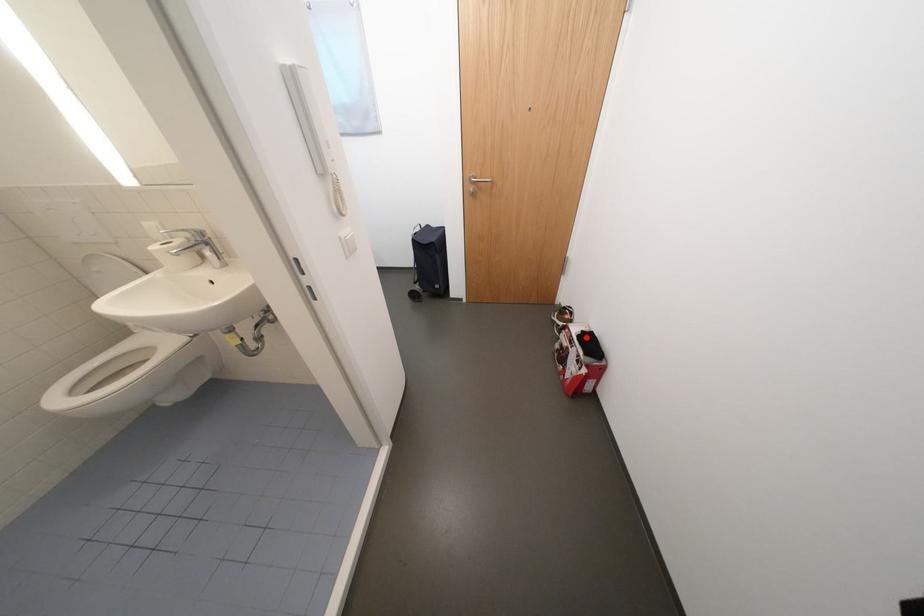
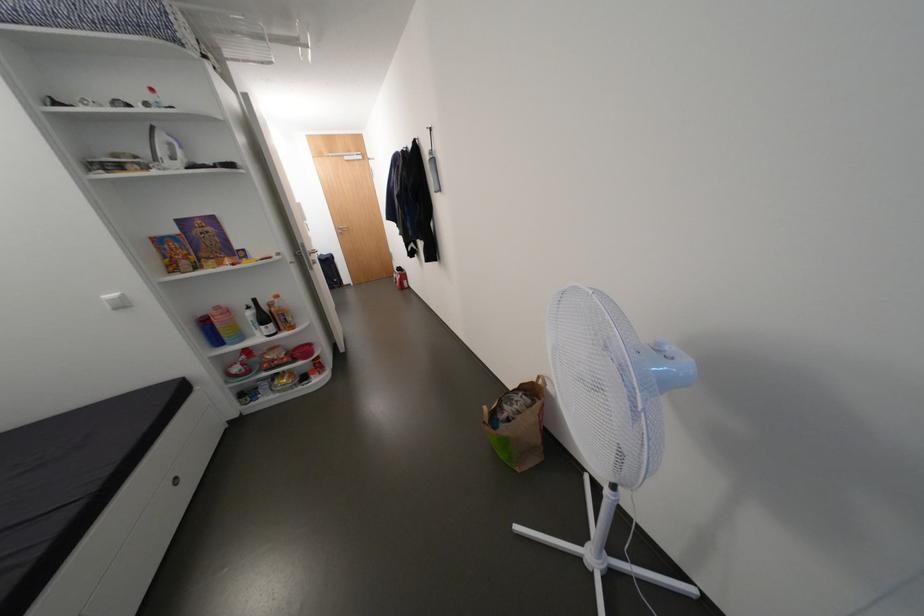
Find the pixel in the second image that matches the highlighted location in the first image.

(405, 270)